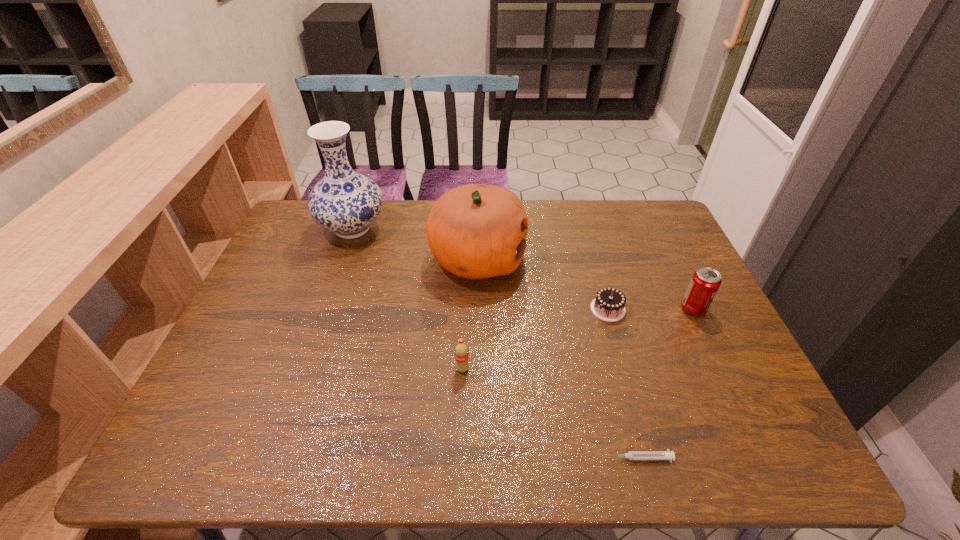
Identify the location of object that is at the near edge. The width and height of the screenshot is (960, 540). [x=631, y=455].

Where is `object present at the left edge`? object present at the left edge is located at coordinates (345, 202).

Image resolution: width=960 pixels, height=540 pixels. In order to click on object present at the right edge in this screenshot , I will do point(705,282).

In order to click on object that is at the far left corner in this screenshot , I will do `click(345, 202)`.

I want to click on free region at the far edge of the desktop, so click(x=545, y=218).

Identify the location of vacant space at the near edge. (338, 430).

Identify the location of vacant space at the left edge of the desktop. Image resolution: width=960 pixels, height=540 pixels. [252, 327].

Where is `vacant space at the right edge of the desktop`? vacant space at the right edge of the desktop is located at coordinates (629, 244).

I want to click on vacant region at the far left corner of the desktop, so click(x=328, y=238).

In the image, there is a desktop. In order to click on vacant space at the near left corner in this screenshot , I will do `click(210, 452)`.